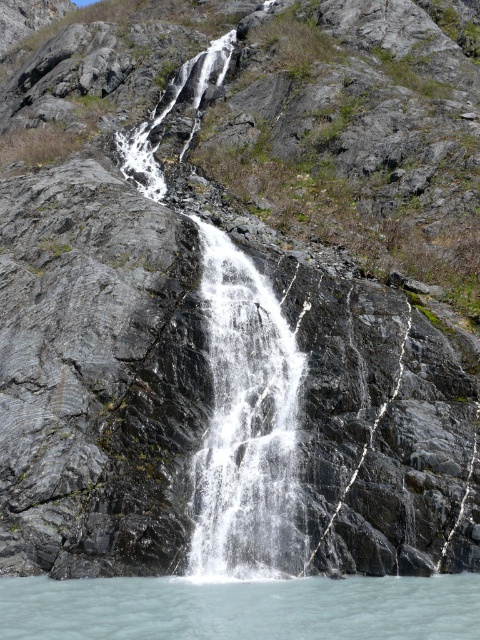
Does white frothy water at center have a greater height compared to clear water at lower center?

Indeed, white frothy water at center has a greater height compared to clear water at lower center.

The image size is (480, 640). What do you see at coordinates (245, 424) in the screenshot?
I see `white frothy water at center` at bounding box center [245, 424].

Where is `white frothy water at center`? The image size is (480, 640). white frothy water at center is located at coordinates [x=245, y=424].